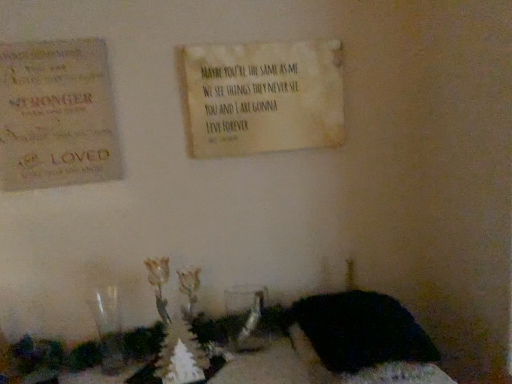
Question: Would you say rustic wood sign at upper left is part of black fabric at lower right's contents?

Choices:
 (A) yes
 (B) no

Answer: (B)

Question: Is black fabric at lower right looking in the opposite direction of rustic wood sign at upper left?

Choices:
 (A) yes
 (B) no

Answer: (B)

Question: Considering the relative positions of black fabric at lower right and rustic wood sign at upper left in the image provided, is black fabric at lower right to the right of rustic wood sign at upper left from the viewer's perspective?

Choices:
 (A) yes
 (B) no

Answer: (A)

Question: From a real-world perspective, is black fabric at lower right over rustic wood sign at upper left?

Choices:
 (A) no
 (B) yes

Answer: (A)

Question: From the image's perspective, is black fabric at lower right beneath rustic wood sign at upper left?

Choices:
 (A) no
 (B) yes

Answer: (B)

Question: From a real-world perspective, is black fabric at lower right located beneath rustic wood sign at upper left?

Choices:
 (A) no
 (B) yes

Answer: (B)

Question: Is there a large distance between black fabric at lower right and beige textured sign at upper center?

Choices:
 (A) no
 (B) yes

Answer: (A)

Question: From the image's perspective, is black fabric at lower right beneath beige textured sign at upper center?

Choices:
 (A) yes
 (B) no

Answer: (A)

Question: Does black fabric at lower right come behind beige textured sign at upper center?

Choices:
 (A) no
 (B) yes

Answer: (A)

Question: Can you confirm if black fabric at lower right is positioned to the right of beige textured sign at upper center?

Choices:
 (A) yes
 (B) no

Answer: (A)

Question: Can beige textured sign at upper center be found inside black fabric at lower right?

Choices:
 (A) no
 (B) yes

Answer: (A)

Question: Is black fabric at lower right next to beige textured sign at upper center?

Choices:
 (A) no
 (B) yes

Answer: (A)

Question: Considering the relative sizes of beige textured sign at upper center and rustic wood sign at upper left in the image provided, is beige textured sign at upper center bigger than rustic wood sign at upper left?

Choices:
 (A) no
 (B) yes

Answer: (B)